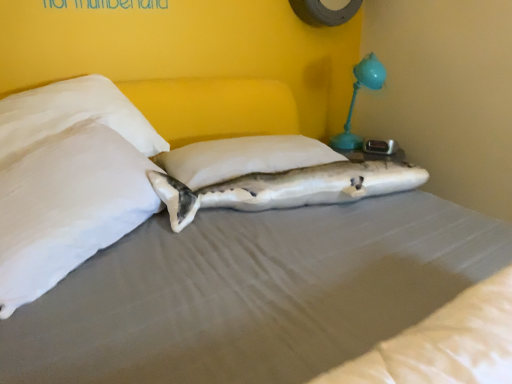
Question: Is white soft pillow at left, the 2th pillow from the right, in front of or behind teal plastic table lamp at upper right in the image?

Choices:
 (A) behind
 (B) front

Answer: (B)

Question: Considering the positions of white soft pillow at left, the 2th pillow from the right, and teal plastic table lamp at upper right in the image, is white soft pillow at left, the 2th pillow from the right, wider or thinner than teal plastic table lamp at upper right?

Choices:
 (A) thin
 (B) wide

Answer: (B)

Question: Which is nearer to the white soft pillow at center, which appears as the 1th pillow when viewed from the right?

Choices:
 (A) teal plastic table lamp at upper right
 (B) white soft pillow at left, the 2th pillow from the right
 (C) white fabric shark at center

Answer: (C)

Question: Estimate the real-world distances between objects in this image. Which object is farther from the white soft pillow at center, the 2th pillow viewed from the left?

Choices:
 (A) teal plastic table lamp at upper right
 (B) white soft pillow at left, the 2th pillow from the right
 (C) white fabric shark at center

Answer: (A)